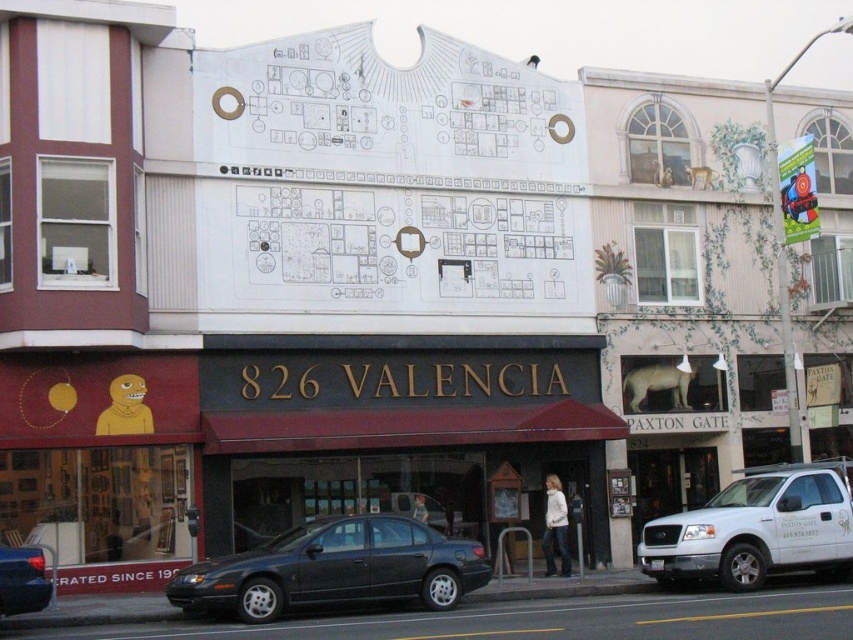
Question: Which of the following is the closest to the observer?

Choices:
 (A) matte black sedan at center
 (B) white matte truck at lower right
 (C) matte black sedan at lower left

Answer: (C)

Question: Is white matte truck at lower right bigger than matte black sedan at lower left?

Choices:
 (A) no
 (B) yes

Answer: (B)

Question: Does white matte truck at lower right appear on the right side of matte black sedan at lower left?

Choices:
 (A) yes
 (B) no

Answer: (A)

Question: Which of the following is the closest to the observer?

Choices:
 (A) matte black sedan at center
 (B) matte black sedan at lower left
 (C) white matte truck at lower right

Answer: (B)

Question: Among these objects, which one is nearest to the camera?

Choices:
 (A) white matte truck at lower right
 (B) matte black sedan at lower left

Answer: (B)

Question: Does white matte truck at lower right appear on the right side of matte black sedan at lower left?

Choices:
 (A) no
 (B) yes

Answer: (B)